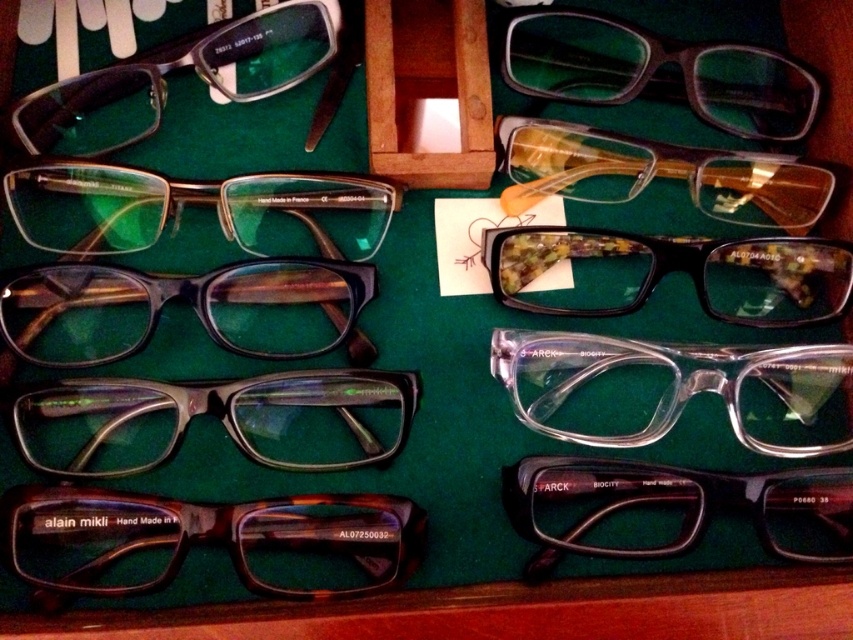
Question: Which object is the farthest from the matte black glasses at upper center?

Choices:
 (A) tortoiseshell acetate glasses at bottom left
 (B) matte black glasses at center
 (C) wooden box at center

Answer: (A)

Question: Can you confirm if translucent plastic glasses at upper right is positioned to the left of wooden box at center?

Choices:
 (A) yes
 (B) no

Answer: (B)

Question: Is matte black glasses at center thinner than matte brown glasses at center?

Choices:
 (A) no
 (B) yes

Answer: (A)

Question: Is multicolored marble glasses at center to the right of matte black glasses at upper center from the viewer's perspective?

Choices:
 (A) no
 (B) yes

Answer: (A)

Question: Among these objects, which one is farthest from the camera?

Choices:
 (A) wooden box at center
 (B) matte black glasses at bottom right
 (C) tortoiseshell acetate glasses at bottom left
 (D) matte brown glasses at center

Answer: (A)

Question: Which object appears farthest from the camera in this image?

Choices:
 (A) matte brown glasses at upper left
 (B) matte brown glasses at center

Answer: (A)